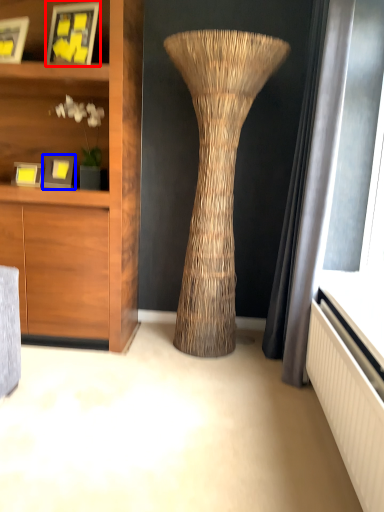
Question: Which object appears closest to the camera in this image, picture frame (highlighted by a red box) or picture frame (highlighted by a blue box)?

Choices:
 (A) picture frame
 (B) picture frame

Answer: (A)